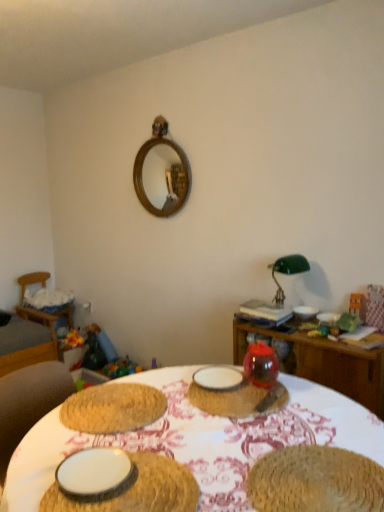
Question: Would you say white matte plate at lower left, which appears as the fourth tableware when viewed from the top, is to the left or to the right of wooden swivel chair at left in the picture?

Choices:
 (A) right
 (B) left

Answer: (A)

Question: Relative to wooden swivel chair at left, is white matte plate at lower left, the first tableware positioned from the bottom, in front or behind?

Choices:
 (A) front
 (B) behind

Answer: (A)

Question: Estimate the real-world distances between objects in this image. Which object is closer to the wooden mirror at upper center?

Choices:
 (A) translucent glass vase at center, which appears as the second tableware when viewed from the front
 (B) white matte plate at lower left, the first tableware positioned from the bottom
 (C) wooden swivel chair at left
 (D) braided straw placemat at lower center, placed as the 1th food when sorted from right to left
 (E) white woven placemat at center, arranged as the 1th table when viewed from the front

Answer: (C)

Question: Estimate the real-world distances between objects in this image. Which object is closer to the wooden swivel chair at left?

Choices:
 (A) wooden table at center, the first table when ordered from back to front
 (B) wooden mirror at upper center
 (C) white woven placemat at center, arranged as the 1th table when viewed from the front
 (D) white matte plate at center, acting as the 3th tableware starting from the right
 (E) white matte plate at lower left, which is the 1th food in left-to-right order

Answer: (B)